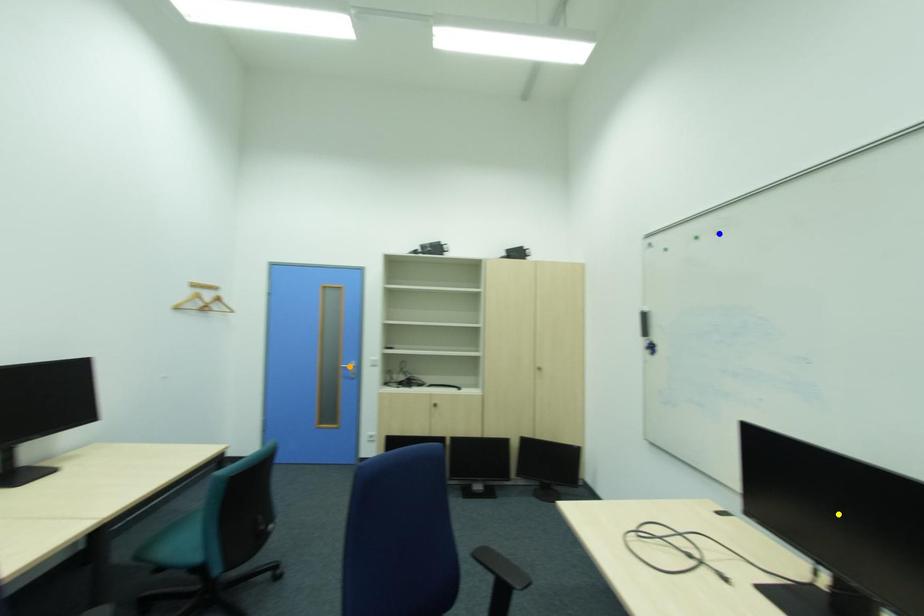
Order these from nearest to farthest:
- yellow point
- blue point
- orange point

yellow point, blue point, orange point